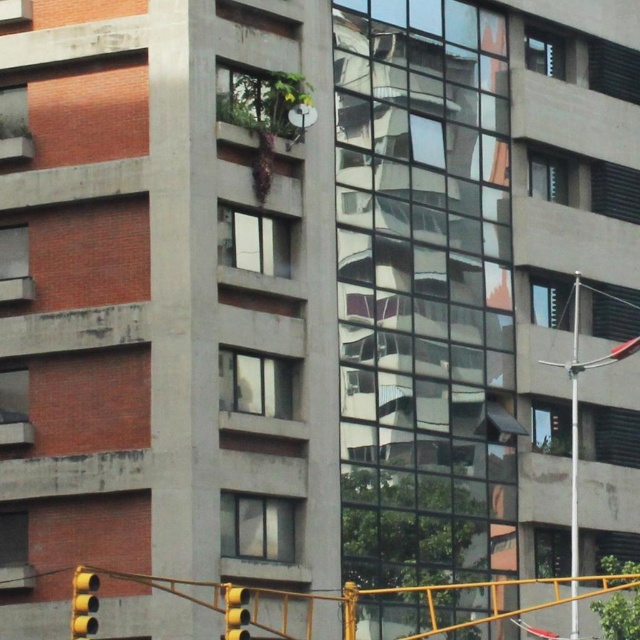
You are a city planner analyzing the building layout. Which object, the metallic pole at right or the yellow matte traffic light at lower left, has a greater height in the scene?

The metallic pole at right is taller than the yellow matte traffic light at lower left.